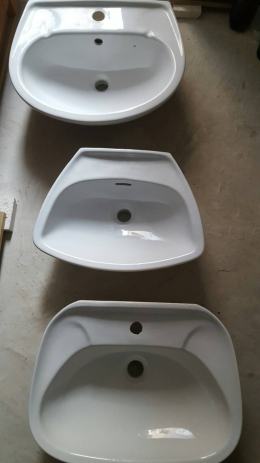
What are the coordinates of `wooden board` in the screenshot? It's located at (2, 219), (182, 9).